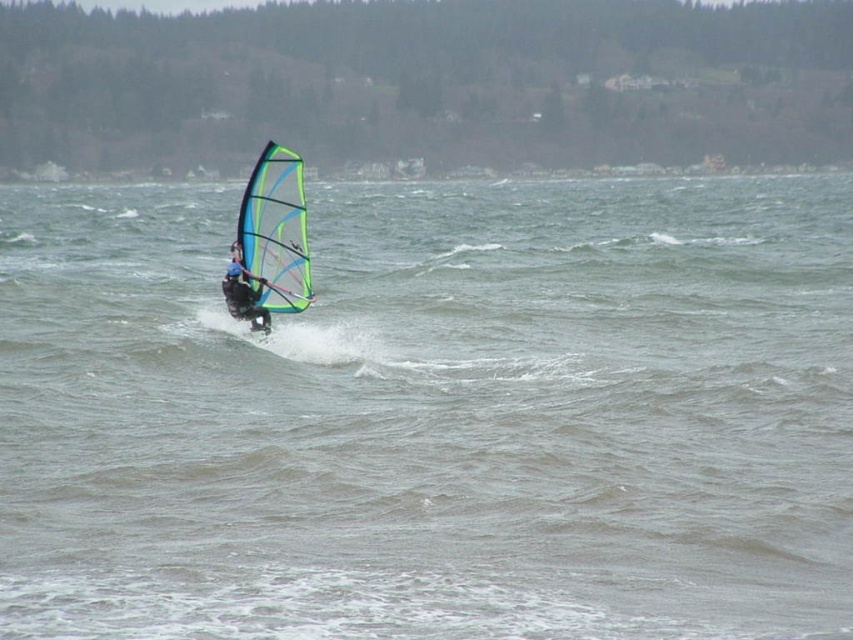
You are a photographer trying to capture the blue matte windsurfer at center and the clear water at center in a single shot. Which object should you adjust your camera focus to first if you want to ensure the windsurfer is sharp before the clear water?

The clear water at center is positioned on the right side of blue matte windsurfer at center. Therefore, you should focus on the blue matte windsurfer at center first, as it is closer to the camera than the clear water at center.